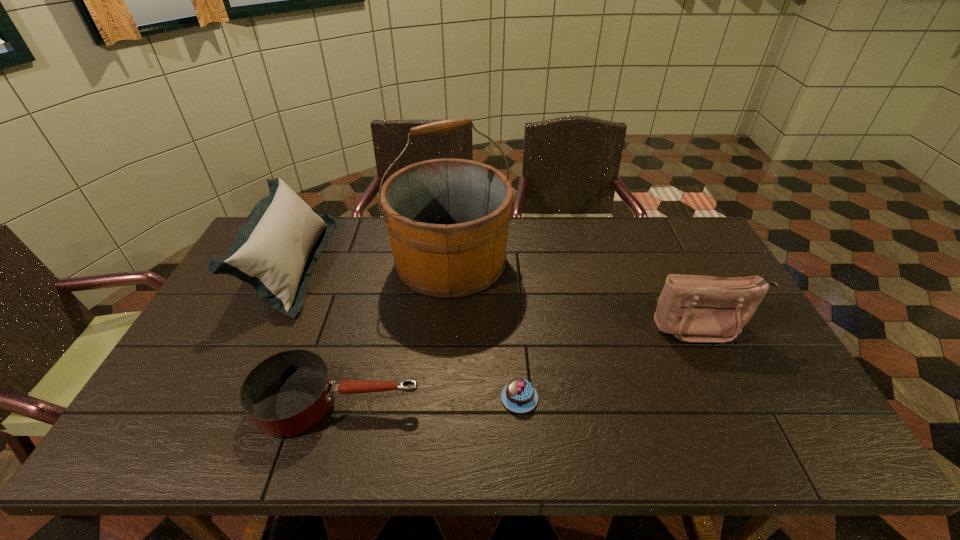
In the image, there is a desktop. Where is `vacant space at the near right corner`? vacant space at the near right corner is located at coordinates 822,441.

The height and width of the screenshot is (540, 960). Identify the location of free space between the cushion and the rightmost object. (496, 295).

Locate an element on the screen. The image size is (960, 540). free space between the cushion and the rightmost object is located at coordinates (496, 295).

Where is `empty location between the pan and the cushion`? Image resolution: width=960 pixels, height=540 pixels. empty location between the pan and the cushion is located at coordinates (314, 333).

The height and width of the screenshot is (540, 960). I want to click on free spot between the fourth tallest object and the cushion, so click(x=314, y=333).

Image resolution: width=960 pixels, height=540 pixels. Identify the location of vacant point located between the fourth tallest object and the chocolate cake. (428, 400).

Locate an element on the screen. Image resolution: width=960 pixels, height=540 pixels. free space between the second shortest object and the tallest object is located at coordinates (394, 332).

Where is `vacant area that lies between the fourth tallest object and the rightmost object`? Image resolution: width=960 pixels, height=540 pixels. vacant area that lies between the fourth tallest object and the rightmost object is located at coordinates (520, 364).

This screenshot has height=540, width=960. I want to click on free area in between the second shortest object and the cushion, so click(314, 333).

Image resolution: width=960 pixels, height=540 pixels. Find the location of `free space between the cushion and the bucket`. free space between the cushion and the bucket is located at coordinates (371, 262).